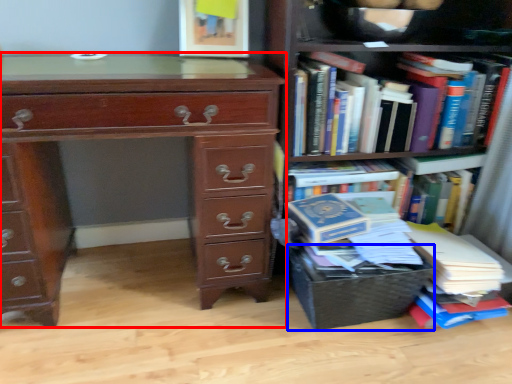
Question: Which point is further to the camera, chest of drawers (highlighted by a red box) or crate (highlighted by a blue box)?

Choices:
 (A) chest of drawers
 (B) crate

Answer: (B)